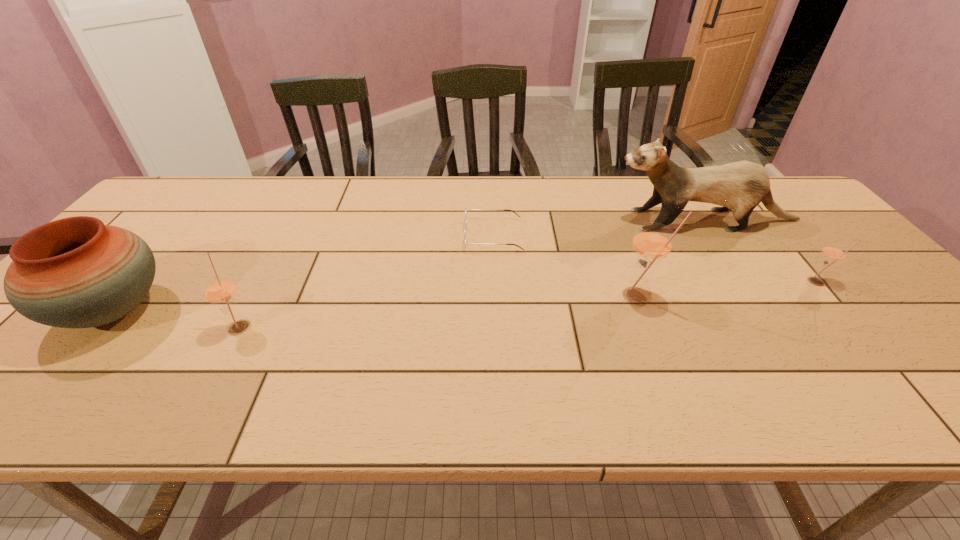
Find the location of a particular element. object positioned at the near edge is located at coordinates (76, 272).

The image size is (960, 540). In order to click on object present at the left edge in this screenshot , I will do `click(76, 272)`.

At what (x,y) coordinates should I click in order to perform the action: click on straw that is positioned at the right edge. Please return your answer as a coordinate pair (x, y). The image size is (960, 540). Looking at the image, I should click on (833, 253).

You are a GUI agent. You are given a task and a screenshot of the screen. Output one action in this format:
    pyautogui.click(x=<x>, y=<y>)
    Task: Click on the ferret that is at the right edge
    
    Given the screenshot: What is the action you would take?
    pyautogui.click(x=742, y=185)

Where is `object situated at the near left corner`? object situated at the near left corner is located at coordinates [76, 272].

Identify the location of object that is at the far right corner. The width and height of the screenshot is (960, 540). (742, 185).

Where is `free space at the far edge of the desktop`? This screenshot has width=960, height=540. free space at the far edge of the desktop is located at coordinates (354, 216).

Where is `vacant area at the near edge of the desktop`? The height and width of the screenshot is (540, 960). vacant area at the near edge of the desktop is located at coordinates (288, 354).

This screenshot has width=960, height=540. In order to click on vacant area at the right edge in this screenshot , I will do `click(810, 237)`.

Where is `free location at the near left corner`? free location at the near left corner is located at coordinates (46, 340).